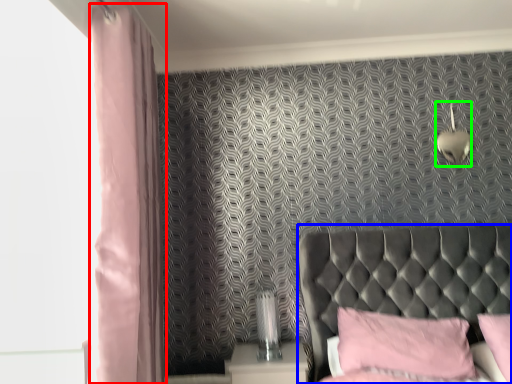
Question: Which object is positioned closest to curtain (highlighted by a red box)? Select from furniture (highlighted by a blue box) and light fixture (highlighted by a green box).

Choices:
 (A) furniture
 (B) light fixture

Answer: (A)